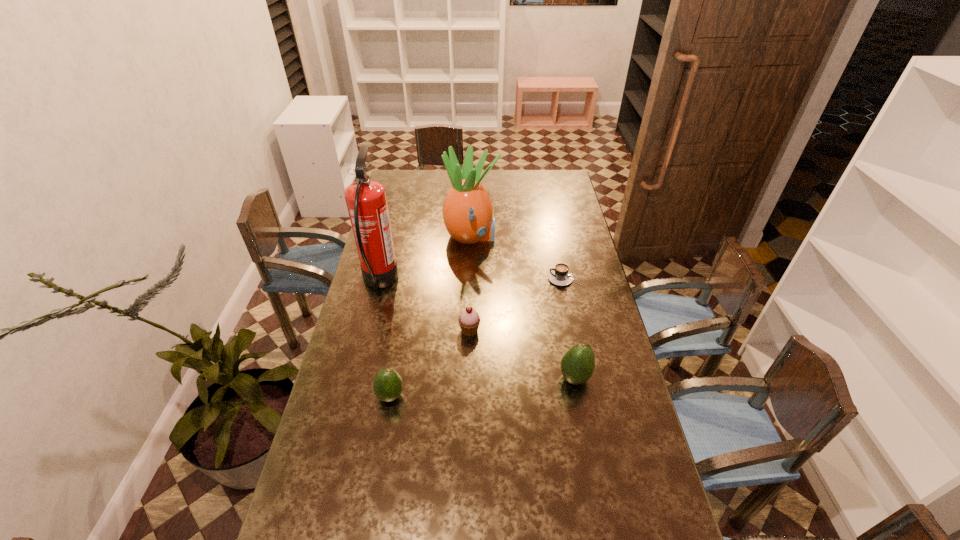
You are a GUI agent. You are given a task and a screenshot of the screen. Output one action in this format:
    pyautogui.click(x=<x>, y=<y>)
    Task: Click on the spot to insert another avocado for uniform distribution
    This screenshot has width=960, height=540.
    Given the screenshot: What is the action you would take?
    click(x=484, y=387)